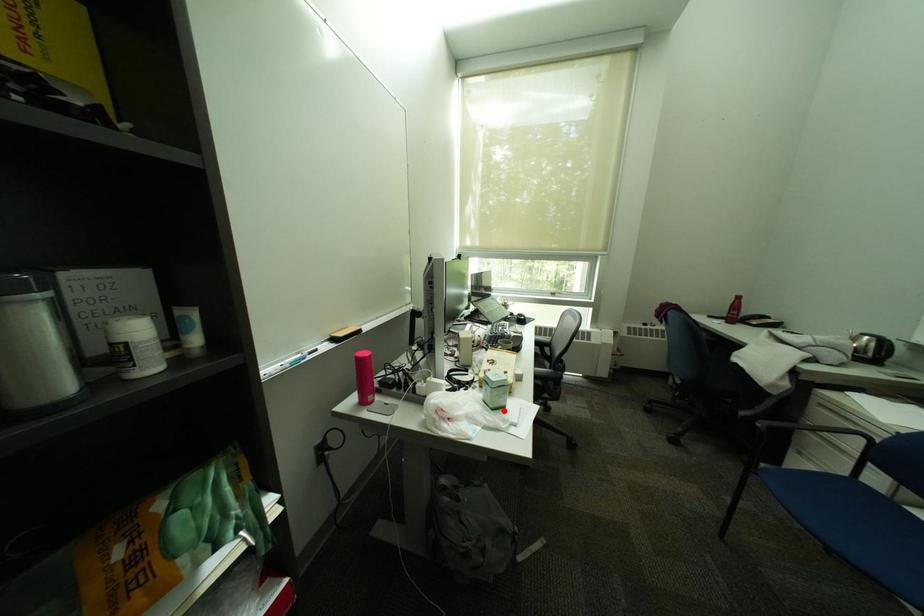
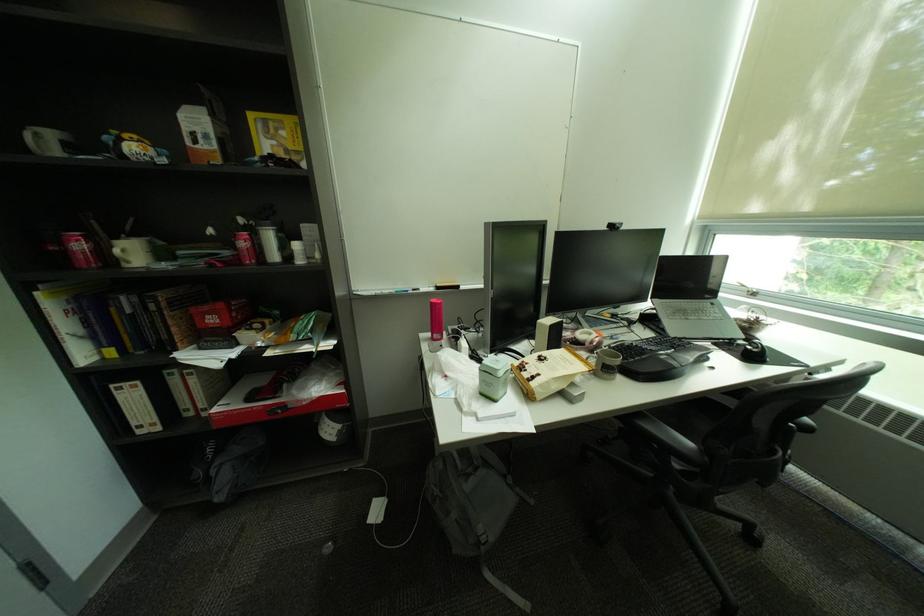
The point at the highlighted location is marked in the first image. Where is the corresponding point in the second image?

(492, 395)